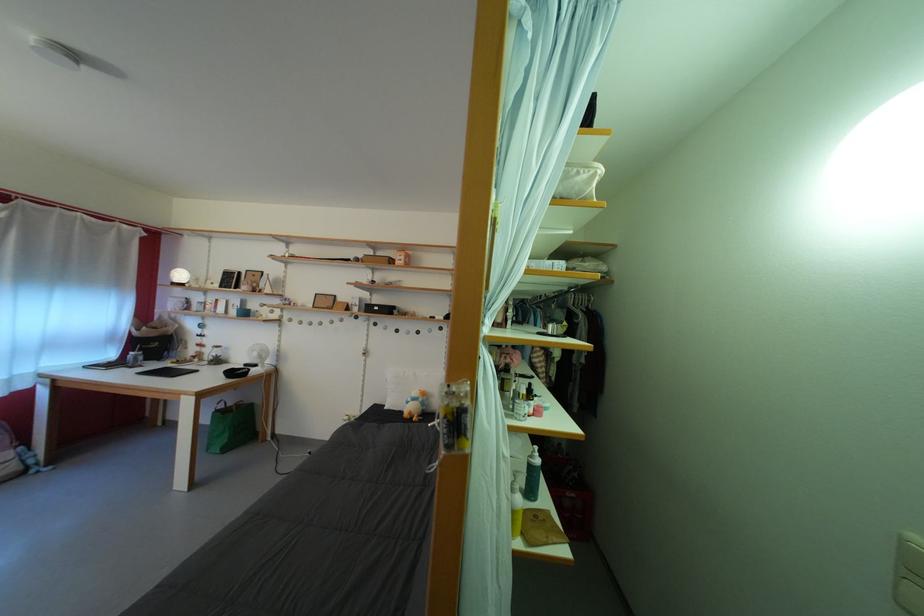
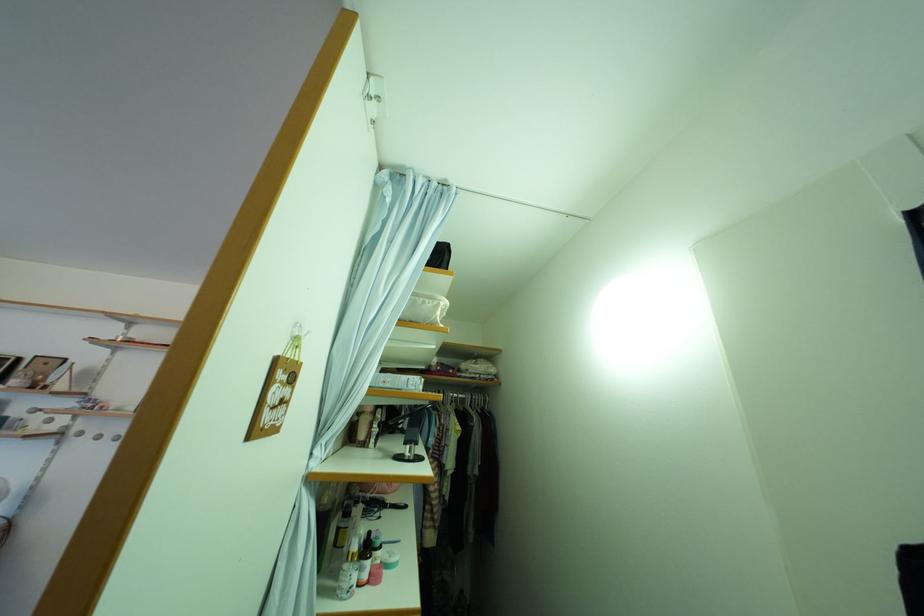
In the second image, find the point that corresponds to the point at 587,179 in the first image.

(432, 309)